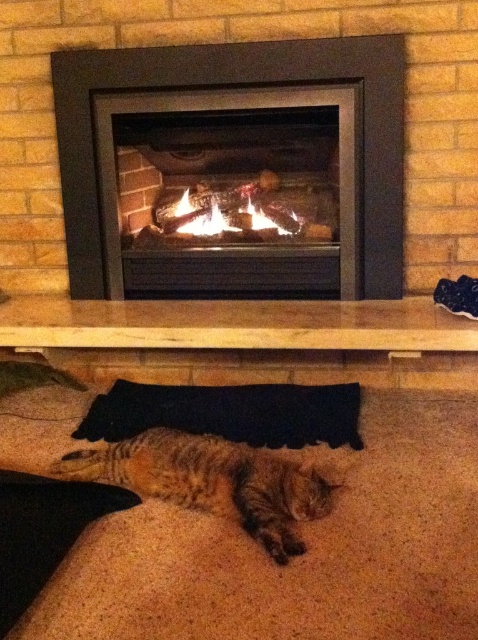
Question: In this image, where is matte black fireplace at center located relative to tabby fur cat at lower center?

Choices:
 (A) left
 (B) right

Answer: (B)

Question: From the image, what is the correct spatial relationship of matte black fireplace at center in relation to tabby fur cat at lower center?

Choices:
 (A) right
 (B) left

Answer: (A)

Question: Among these points, which one is nearest to the camera?

Choices:
 (A) (93, 116)
 (B) (218, 211)

Answer: (A)

Question: Which of the following is the closest to the observer?

Choices:
 (A) tabby fur cat at lower center
 (B) orange flame logs at center

Answer: (A)

Question: Does matte black fireplace at center lie behind tabby fur cat at lower center?

Choices:
 (A) yes
 (B) no

Answer: (A)

Question: Among these points, which one is farthest from the camera?

Choices:
 (A) (72, 122)
 (B) (107, 477)
 (C) (199, 195)

Answer: (C)